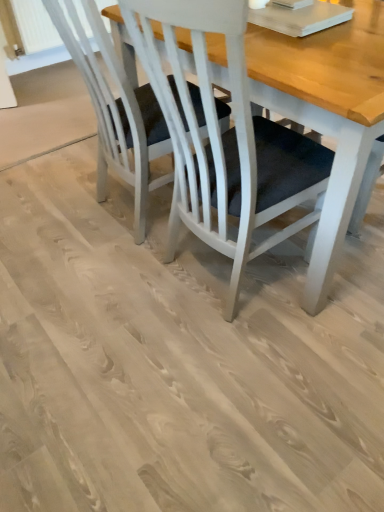
Where is `vacant space that is to the left of white painted wood chair at center`? This screenshot has height=512, width=384. vacant space that is to the left of white painted wood chair at center is located at coordinates (48, 213).